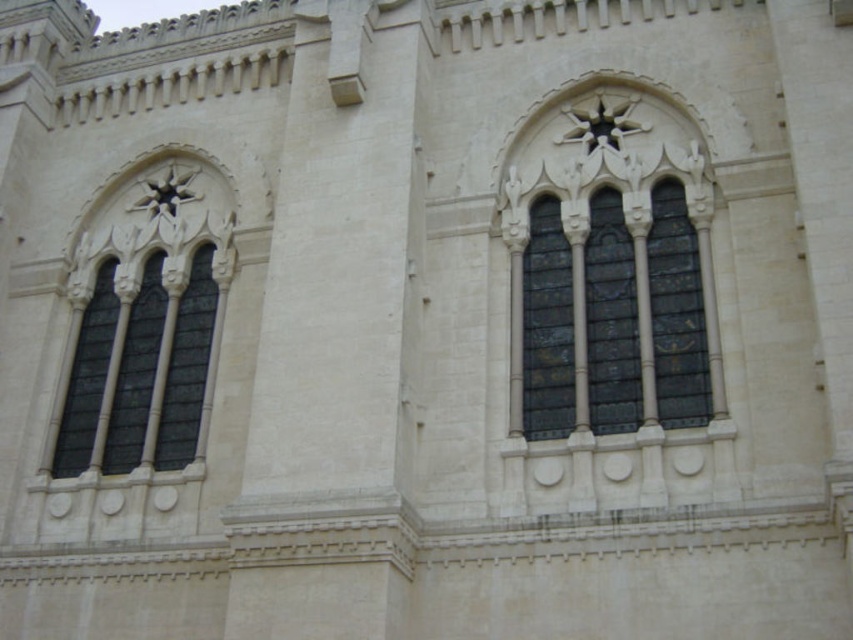
You are an architect examining the building facade. You notice the stained glass window at center and the dark glass windows at left. Which window type has a larger overall size?

The dark glass windows at left are larger in size compared to the stained glass window at center.

You are standing in front of a historical building and want to take a photo of the stained glass window at center. Considering the distance, will you need to use a zoom lens to capture the entire window in your shot?

The stained glass window at center is 43.58 meters away from the viewer. At this distance, a standard lens might not capture the entire window, so using a zoom lens would be advisable to ensure the entire window fits in the frame.

You are an architect examining the building facade. You need to determine which window has a narrower width between the stained glass window at center and the dark glass windows at left. Based on the scene description, which one is narrower?

The stained glass window at center is thinner than the dark glass windows at left, so the stained glass window at center has a narrower width.